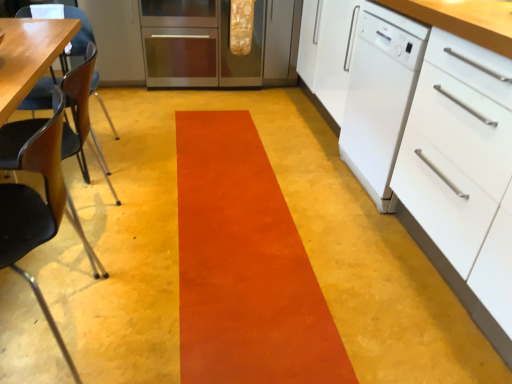
Question: Is wooden chair at left, the 2th chair from the front, spatially inside stainless steel oven at center, or outside of it?

Choices:
 (A) outside
 (B) inside

Answer: (A)

Question: Is wooden chair at left, the 2th chair from the front, in front of or behind stainless steel oven at center in the image?

Choices:
 (A) front
 (B) behind

Answer: (A)

Question: Estimate the real-world distances between objects in this image. Which object is farther from the black plastic chair at left, the 2th chair positioned from the back?

Choices:
 (A) orange suede rug at center
 (B) stainless steel oven at center
 (C) white glossy dishwasher at right
 (D) white matte drawer at right
 (E) wooden chair at left, the 2th chair from the front

Answer: (B)

Question: Which of these objects is positioned closest to the orange suede rug at center?

Choices:
 (A) black plastic chair at left, the 2th chair positioned from the back
 (B) white glossy dishwasher at right
 (C) stainless steel oven at center
 (D) wooden chair at left, which is the 1th chair in back-to-front order
 (E) white matte drawer at right

Answer: (E)